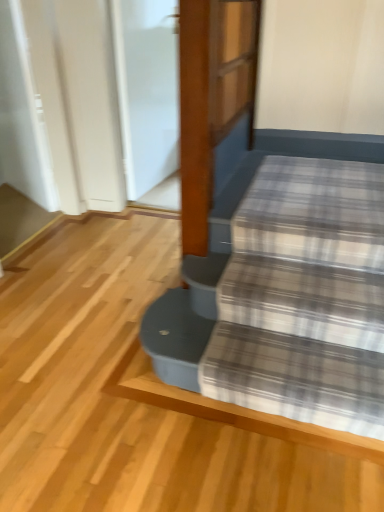
The image size is (384, 512). What are the coordinates of `free space above plaid fabric at lower right (from a real-world perspective)` in the screenshot? It's located at (260, 344).